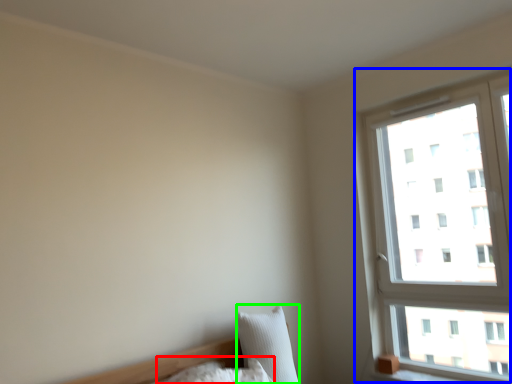
Question: Which is nearer to the pillow (highlighted by a red box)? window (highlighted by a blue box) or pillow (highlighted by a green box).

Choices:
 (A) window
 (B) pillow

Answer: (B)